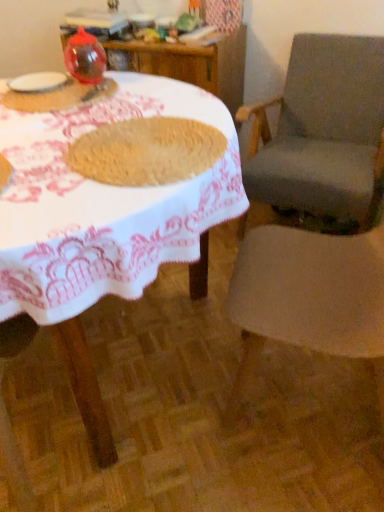
Question: Can you confirm if transparent plastic balloon at upper left, placed as the third tableware when sorted from bottom to top, is taller than translucent plastic cup at upper left, the 3th tableware in the top-to-bottom sequence?

Choices:
 (A) no
 (B) yes

Answer: (B)

Question: Is transparent plastic balloon at upper left, which is counted as the 1th tableware, starting from the top, shorter than translucent plastic cup at upper left, which appears as the first tableware when ordered from the bottom?

Choices:
 (A) no
 (B) yes

Answer: (A)

Question: Does transparent plastic balloon at upper left, placed as the third tableware when sorted from bottom to top, have a lesser width compared to translucent plastic cup at upper left, which appears as the first tableware when ordered from the bottom?

Choices:
 (A) no
 (B) yes

Answer: (B)

Question: From a real-world perspective, is transparent plastic balloon at upper left, placed as the third tableware when sorted from bottom to top, located higher than translucent plastic cup at upper left, which appears as the first tableware when ordered from the bottom?

Choices:
 (A) yes
 (B) no

Answer: (A)

Question: Does transparent plastic balloon at upper left, which is counted as the 1th tableware, starting from the top, lie behind translucent plastic cup at upper left, the 3th tableware in the top-to-bottom sequence?

Choices:
 (A) yes
 (B) no

Answer: (A)

Question: Is transparent plastic balloon at upper left, which is counted as the 1th tableware, starting from the top, not within translucent plastic cup at upper left, the 3th tableware in the top-to-bottom sequence?

Choices:
 (A) no
 (B) yes

Answer: (B)

Question: From a real-world perspective, is gray fabric chair at right, marked as the first chair in a back-to-front arrangement, beneath white matte plate at upper left, marked as the 2th tableware in a bottom-to-top arrangement?

Choices:
 (A) yes
 (B) no

Answer: (A)

Question: Does gray fabric chair at right, marked as the first chair in a back-to-front arrangement, come in front of white matte plate at upper left, marked as the 2th tableware in a bottom-to-top arrangement?

Choices:
 (A) yes
 (B) no

Answer: (A)

Question: Are gray fabric chair at right, marked as the first chair in a back-to-front arrangement, and white matte plate at upper left, marked as the 2th tableware in a bottom-to-top arrangement, making contact?

Choices:
 (A) no
 (B) yes

Answer: (A)

Question: Is gray fabric chair at right, which ranks as the 2th chair in front-to-back order, completely or partially outside of white matte plate at upper left, marked as the 2th tableware in a bottom-to-top arrangement?

Choices:
 (A) no
 (B) yes

Answer: (B)

Question: Is gray fabric chair at right, marked as the first chair in a back-to-front arrangement, behind white matte plate at upper left, marked as the 2th tableware in a bottom-to-top arrangement?

Choices:
 (A) yes
 (B) no

Answer: (B)

Question: Could you tell me if gray fabric chair at right, marked as the first chair in a back-to-front arrangement, is turned towards white matte plate at upper left, which is the 2th tableware from top to bottom?

Choices:
 (A) yes
 (B) no

Answer: (B)

Question: From a real-world perspective, is white woven table at center beneath translucent plastic cup at upper left, which appears as the first tableware when ordered from the bottom?

Choices:
 (A) no
 (B) yes

Answer: (B)